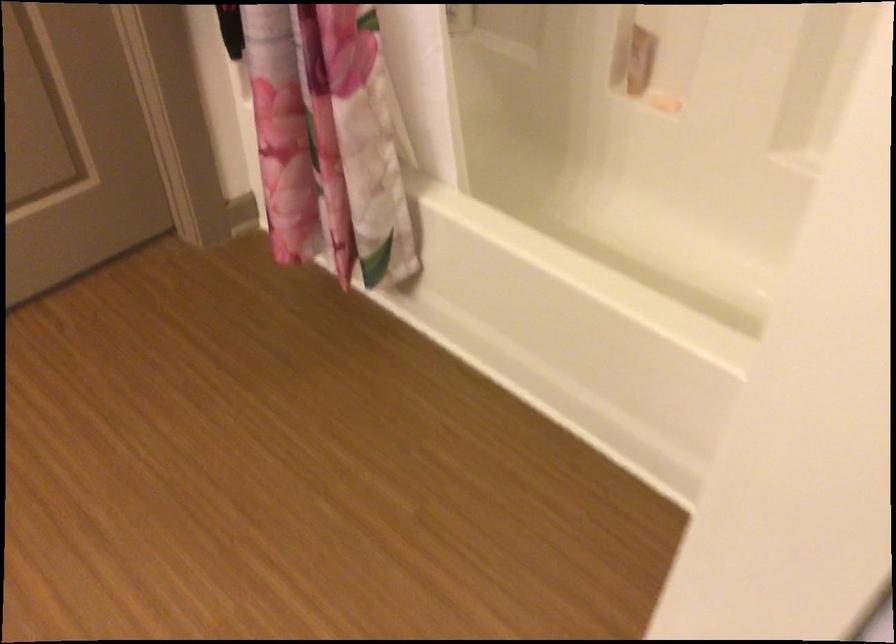
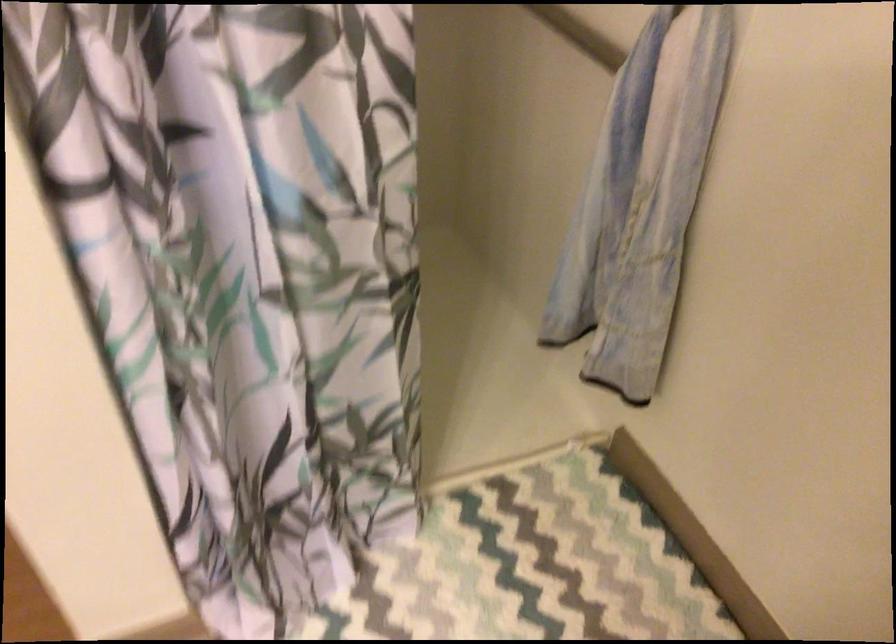
Based on the continuous images, in which direction is the camera rotating?

The camera's rotation is toward right-down.